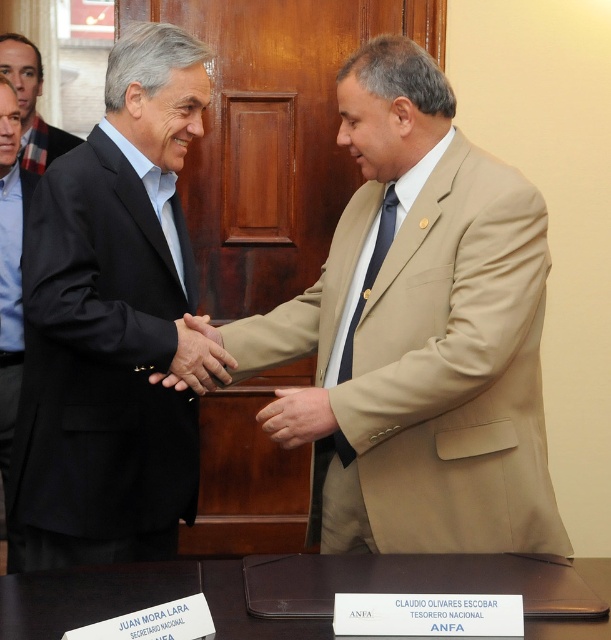
Question: Does light brown suit at left appear under matte black suit at upper left?

Choices:
 (A) no
 (B) yes

Answer: (B)

Question: Which object is the closest to the matte black suit at left?

Choices:
 (A) matte black suit at center
 (B) brown leather hand at center

Answer: (B)

Question: Which point appears farthest from the camera in this image?

Choices:
 (A) (207, 385)
 (B) (38, 172)

Answer: (B)

Question: Can you confirm if matte black suit at left is thinner than tan fabric hand at center?

Choices:
 (A) yes
 (B) no

Answer: (B)

Question: Which object is closer to the camera taking this photo?

Choices:
 (A) matte black suit at upper left
 (B) tan fabric hand at center
 (C) brown leather hand at center

Answer: (B)

Question: Does matte black suit at left appear on the right side of brown leather hand at center?

Choices:
 (A) no
 (B) yes

Answer: (A)